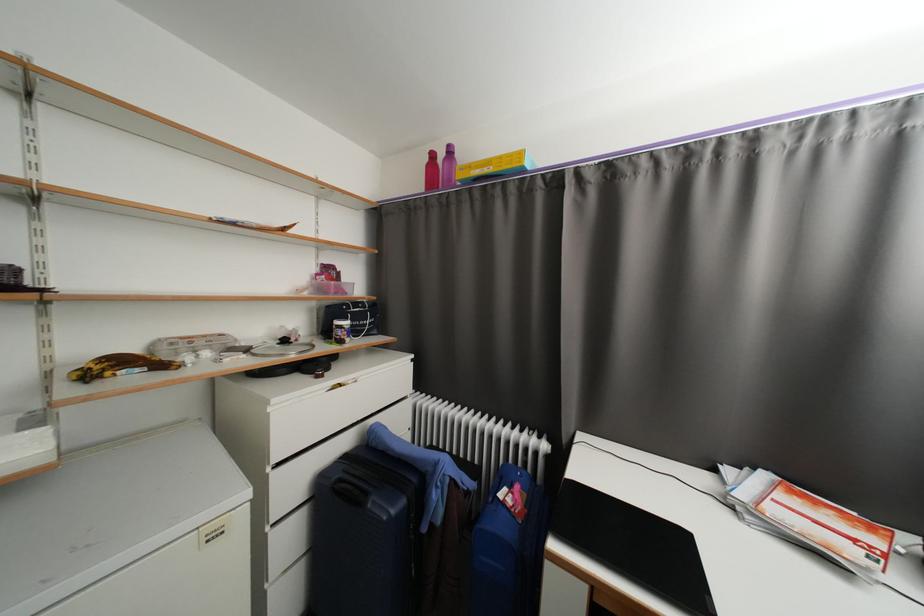
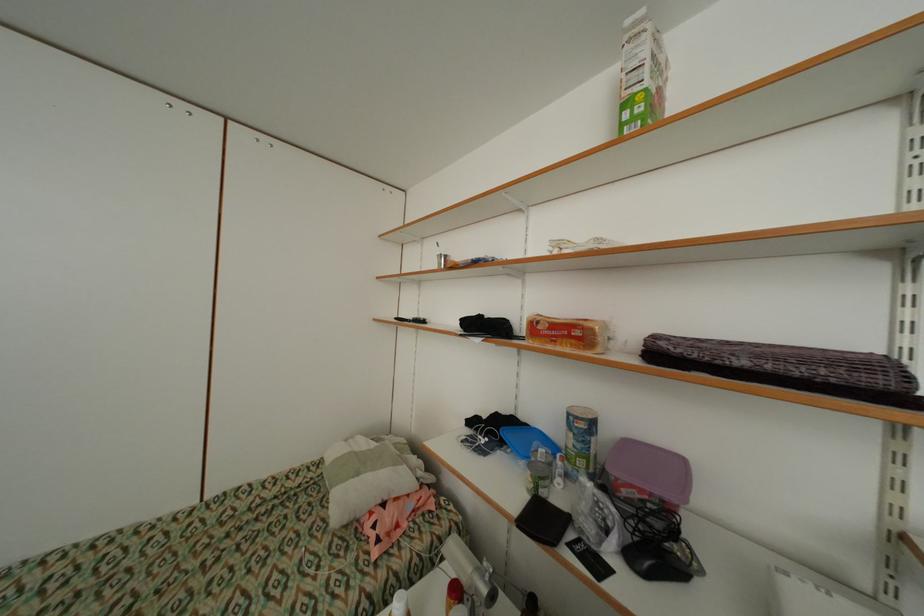
Question: The first image is from the beginning of the video and the second image is from the end. How did the camera likely rotate when shooting the video?

Choices:
 (A) Left
 (B) Right
 (C) Up
 (D) Down

Answer: (A)